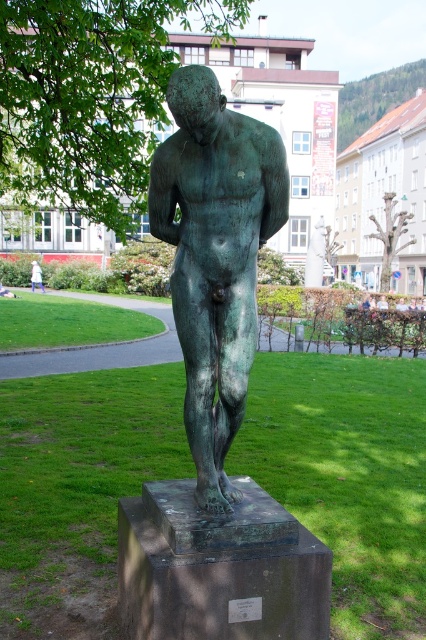
Question: Which of the following is the closest to the observer?

Choices:
 (A) (22, 513)
 (B) (120, 81)
 (C) (43, 284)
 (D) (376, 116)

Answer: (A)

Question: Which object appears closest to the camera in this image?

Choices:
 (A) white cotton shirt at lower left
 (B) green patina statue at center
 (C) green textured tree at center
 (D) green leafy tree at upper left

Answer: (B)

Question: Can you confirm if green leafy tree at upper center is bigger than green textured tree at center?

Choices:
 (A) yes
 (B) no

Answer: (B)

Question: Is green patina bronze statue at center further to the viewer compared to green textured tree at center?

Choices:
 (A) yes
 (B) no

Answer: (B)

Question: Does green patina statue at center appear over green patina bronze statue at center?

Choices:
 (A) no
 (B) yes

Answer: (A)

Question: Which point is farther to the camera?

Choices:
 (A) (39, 157)
 (B) (411, 97)

Answer: (B)